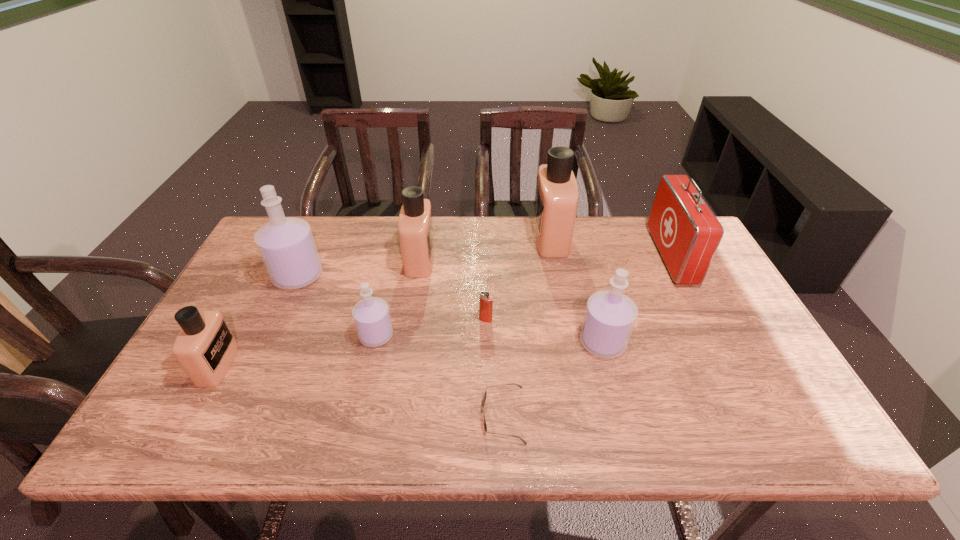
Image resolution: width=960 pixels, height=540 pixels. Find the location of `igniter`. igniter is located at coordinates (485, 300).

Find the location of `the fifth nearest object`. the fifth nearest object is located at coordinates (485, 300).

You are a GUI agent. You are given a task and a screenshot of the screen. Output one action in this format:
    pyautogui.click(x=<x>, y=<y>)
    Task: Click on the black sunglasses
    This screenshot has height=540, width=960.
    Given the screenshot: What is the action you would take?
    pyautogui.click(x=485, y=425)

Find the location of a particular element. This screenshot has height=540, width=960. the shortest object is located at coordinates (485, 425).

Identify the location of free location located on the front label of the biggest beige perfume. The width and height of the screenshot is (960, 540). (479, 237).

At what (x,y) coordinates should I click in order to perform the action: click on free space located 0.110m on the front label of the biggest beige perfume. Please return your answer as a coordinate pair (x, y). This screenshot has height=540, width=960. Looking at the image, I should click on (500, 237).

Find the location of a particular element. This screenshot has height=540, width=960. vacant space located 0.330m on the front label of the biggest beige perfume is located at coordinates (433, 237).

Where is `free spot located on the front of the biggest purple perfume`? free spot located on the front of the biggest purple perfume is located at coordinates (279, 316).

Where is `free space located on the side of the rightmost object with the first aid cross symbol`? The height and width of the screenshot is (540, 960). free space located on the side of the rightmost object with the first aid cross symbol is located at coordinates (578, 256).

Where is `blank area located 0.180m on the side of the rightmost object with the first aid cross symbol`? The width and height of the screenshot is (960, 540). blank area located 0.180m on the side of the rightmost object with the first aid cross symbol is located at coordinates (601, 256).